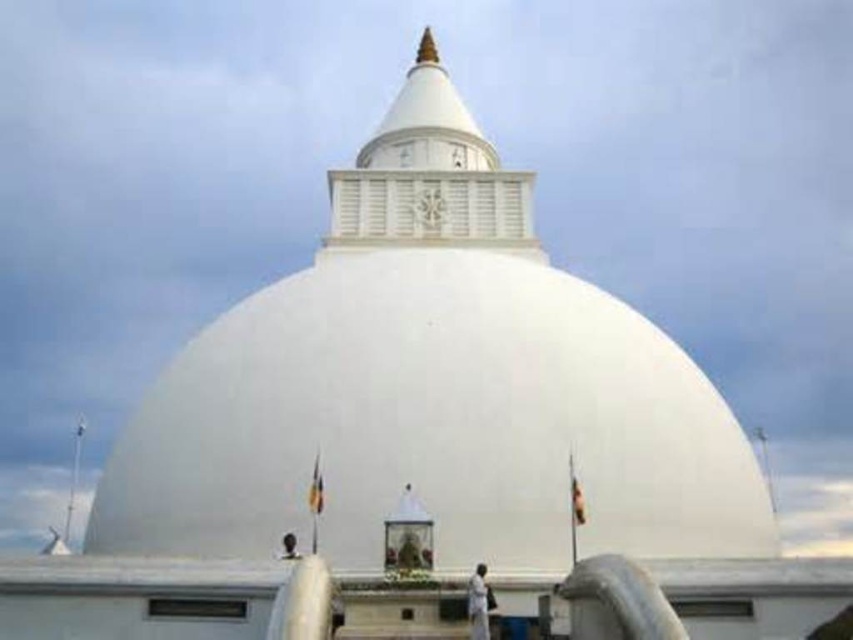
Does white fabric person at lower center appear on the right side of black matte person at center?

Yes, white fabric person at lower center is to the right of black matte person at center.

Does white fabric person at lower center have a larger size compared to black matte person at center?

Yes, white fabric person at lower center is bigger than black matte person at center.

Who is more forward, [485,625] or [289,547]?

Point [485,625]

Where is `white fabric person at lower center`? The image size is (853, 640). white fabric person at lower center is located at coordinates coord(479,604).

Which is behind, point (535, 566) or point (485, 582)?

Point (535, 566)

Is point (524, 481) positioned before point (479, 634)?

That is False.

The width and height of the screenshot is (853, 640). In order to click on white smooth dome at center in this screenshot , I will do `click(432, 387)`.

Is white smooth dome at center shorter than black matte person at center?

No.

This screenshot has width=853, height=640. What are the coordinates of `white smooth dome at center` in the screenshot? It's located at (432, 387).